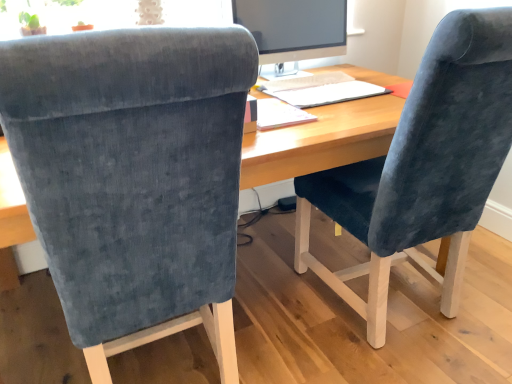
You are a GUI agent. You are given a task and a screenshot of the screen. Output one action in this format:
    pyautogui.click(x=<x>, y=<y>)
    Task: Click on the free spot below velvet blue chair at right, the 2th chair viewed from the left (from a real-world perspective)
    
    Given the screenshot: What is the action you would take?
    pyautogui.click(x=415, y=327)